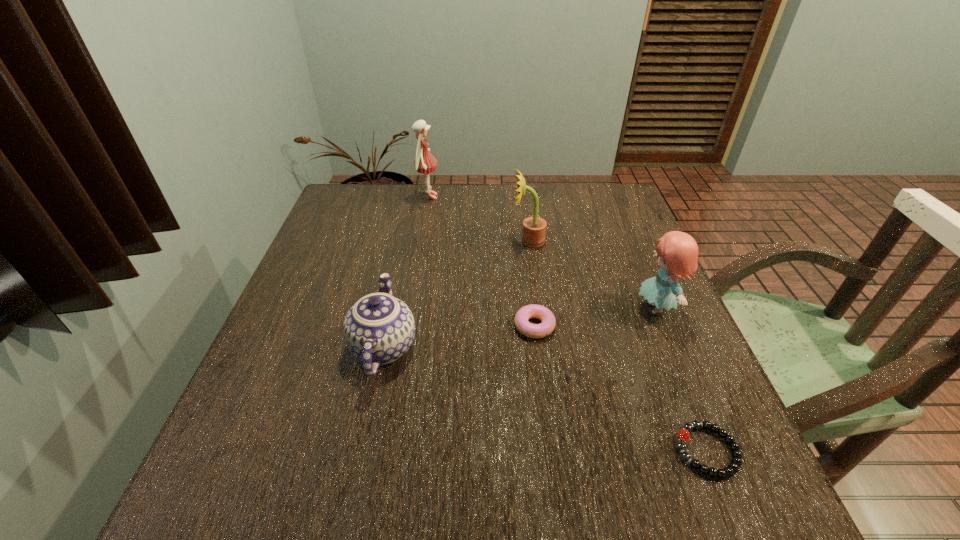
This screenshot has height=540, width=960. Find the location of `vacant area situated on the back of the shortest object`. vacant area situated on the back of the shortest object is located at coordinates (660, 335).

What are the coordinates of `object situated at the far edge` in the screenshot? It's located at (424, 162).

Where is `object at the near edge`? The image size is (960, 540). object at the near edge is located at coordinates (683, 435).

Where is `doll present at the right edge`? doll present at the right edge is located at coordinates (677, 252).

Find the location of a particular element. bracelet that is positioned at the right edge is located at coordinates (683, 435).

At what (x,y) coordinates should I click in order to perform the action: click on object that is at the near right corner. Please return your answer as a coordinate pair (x, y). Image resolution: width=960 pixels, height=540 pixels. Looking at the image, I should click on (683, 435).

This screenshot has width=960, height=540. Identify the location of free space at the far edge of the desktop. (462, 185).

Where is `vacant space at the near edge of the desktop`? The width and height of the screenshot is (960, 540). vacant space at the near edge of the desktop is located at coordinates (615, 511).

What are the coordinates of `vacant position at the left edge of the desktop` in the screenshot? It's located at (252, 404).

This screenshot has width=960, height=540. Identify the location of free space at the right edge of the desktop. (684, 398).